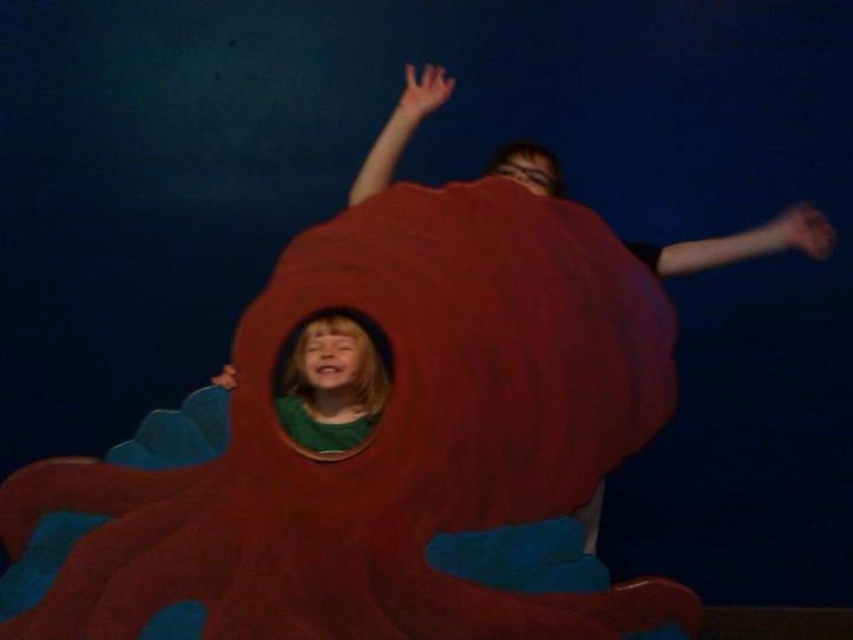
Question: Is matte red octopus at center thinner than matte green shirt at center?

Choices:
 (A) yes
 (B) no

Answer: (B)

Question: Which object is closer to the camera taking this photo?

Choices:
 (A) matte green shirt at center
 (B) matte red octopus at center

Answer: (B)

Question: Can you confirm if matte red octopus at center is thinner than matte green shirt at center?

Choices:
 (A) yes
 (B) no

Answer: (B)

Question: Which object appears closest to the camera in this image?

Choices:
 (A) matte green shirt at center
 (B) matte red octopus at center

Answer: (B)

Question: Among these points, which one is farthest from the camera?

Choices:
 (A) (343, 442)
 (B) (480, 477)

Answer: (A)

Question: Is matte red octopus at center to the right of matte green shirt at center from the viewer's perspective?

Choices:
 (A) yes
 (B) no

Answer: (A)